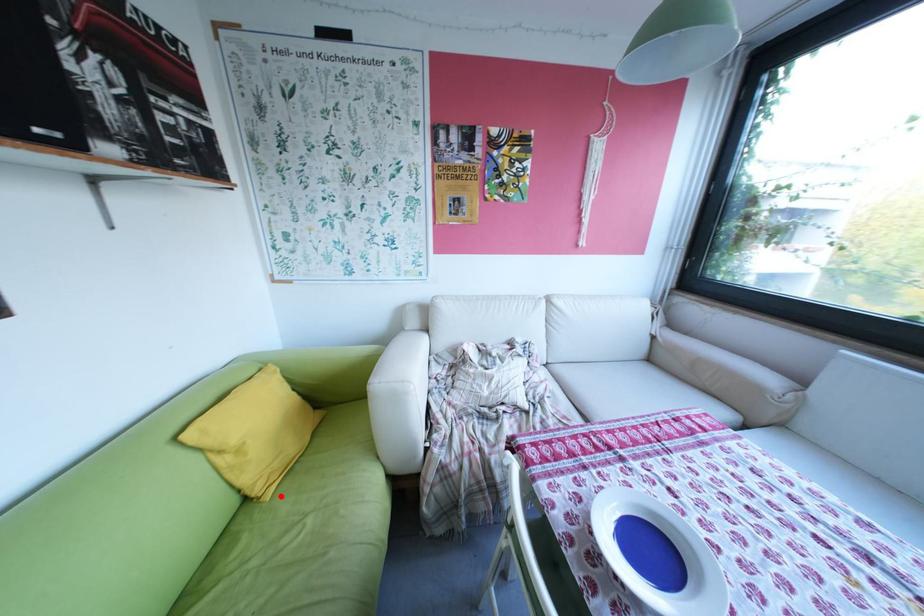
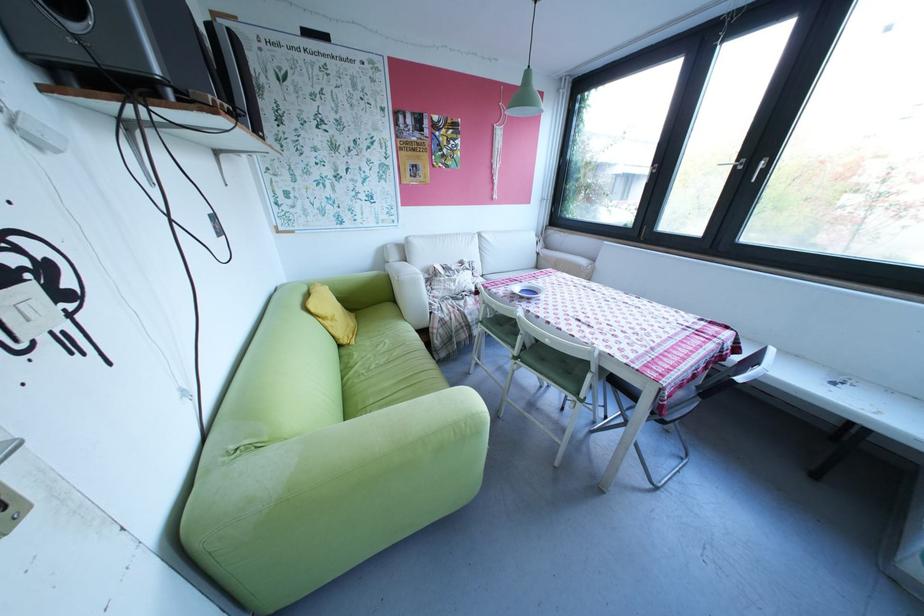
Where in the second image is the point corresponding to the highlighted location from the first image?

(366, 342)